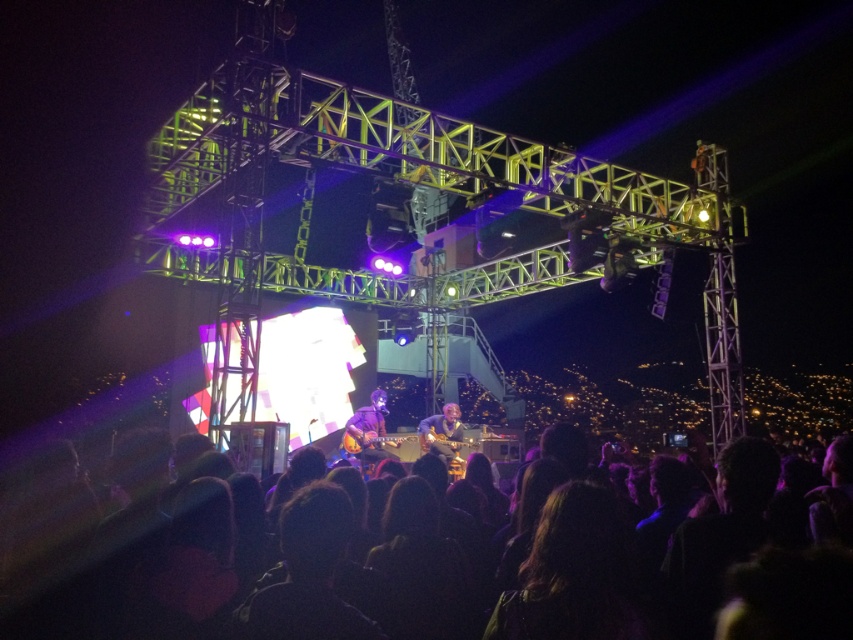
Question: Is purple matte guitar at center thinner than matte brown guitar at center?

Choices:
 (A) yes
 (B) no

Answer: (B)

Question: Which point is farther from the camera taking this photo?

Choices:
 (A) (161, 524)
 (B) (451, 458)

Answer: (B)

Question: Which point appears closest to the camera in this image?

Choices:
 (A) (827, 600)
 (B) (447, 454)
 (C) (363, 436)

Answer: (A)

Question: Can you confirm if black hair at lower center is positioned above matte brown guitar at center?

Choices:
 (A) no
 (B) yes

Answer: (A)

Question: Does black hair at lower center appear on the right side of matte brown guitar at center?

Choices:
 (A) yes
 (B) no

Answer: (A)

Question: Which object is positioned farthest from the purple matte guitar at center?

Choices:
 (A) matte brown guitar at center
 (B) black hair at lower center

Answer: (B)